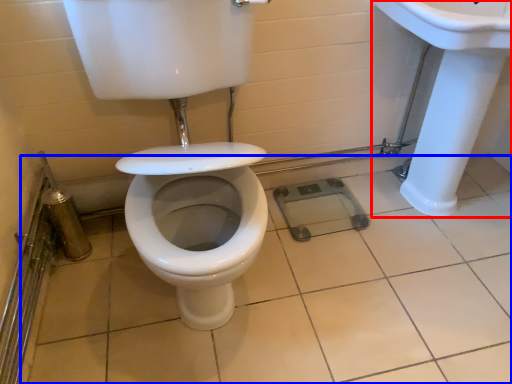
Question: Which of the following is the farthest to the observer, sink (highlighted by a red box) or ceramic tile (highlighted by a blue box)?

Choices:
 (A) sink
 (B) ceramic tile

Answer: (A)